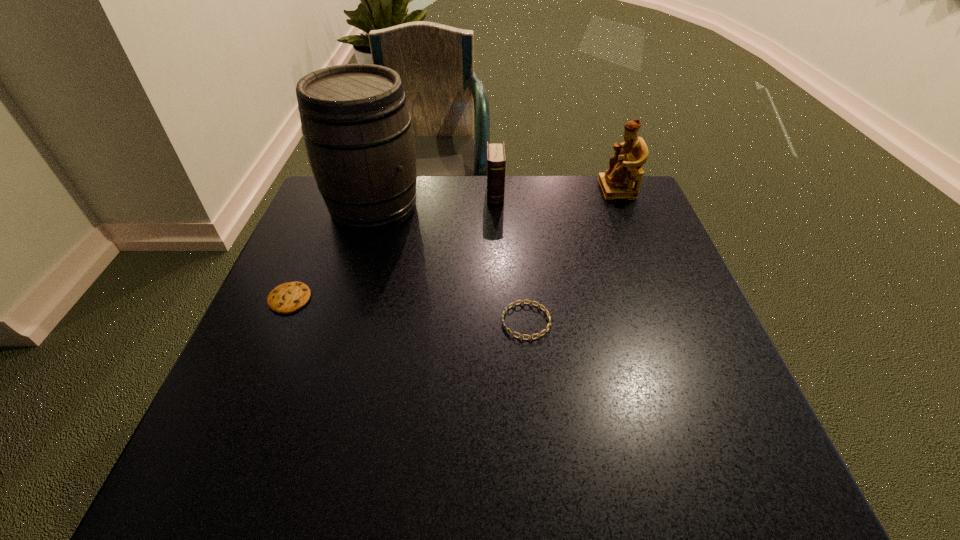
Locate an element on the screen. The image size is (960, 540). vacant area in the image that satisfies the following two spatial constraints: 1. on the back side of the wine bucket; 2. on the left side of the cookie is located at coordinates (328, 207).

Identify the location of free space that satisfies the following two spatial constraints: 1. on the front-facing side of the fourth shortest object; 2. on the spine side of the third tallest object. This screenshot has width=960, height=540. (619, 195).